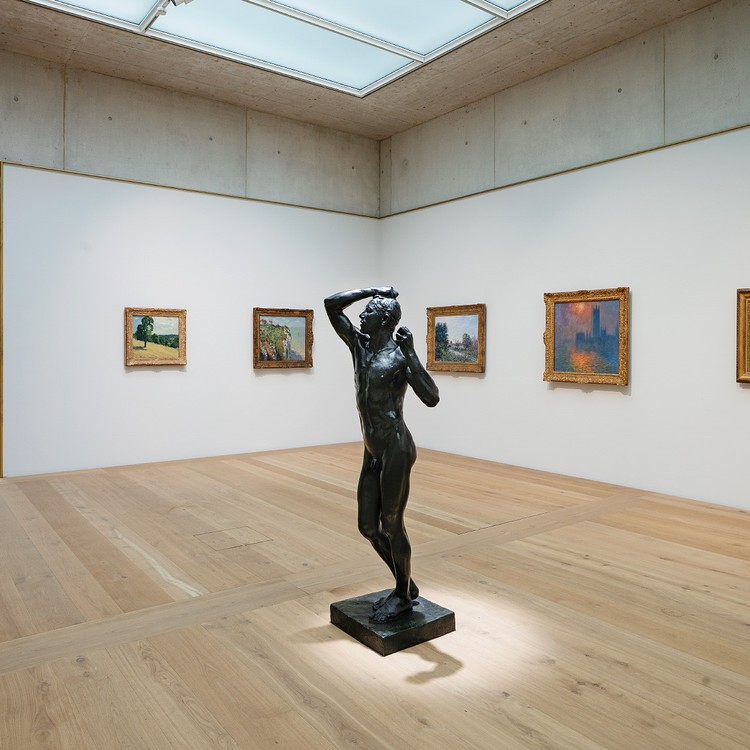
The width and height of the screenshot is (750, 750). What are the coordinates of `black statue` in the screenshot? It's located at (393, 446).